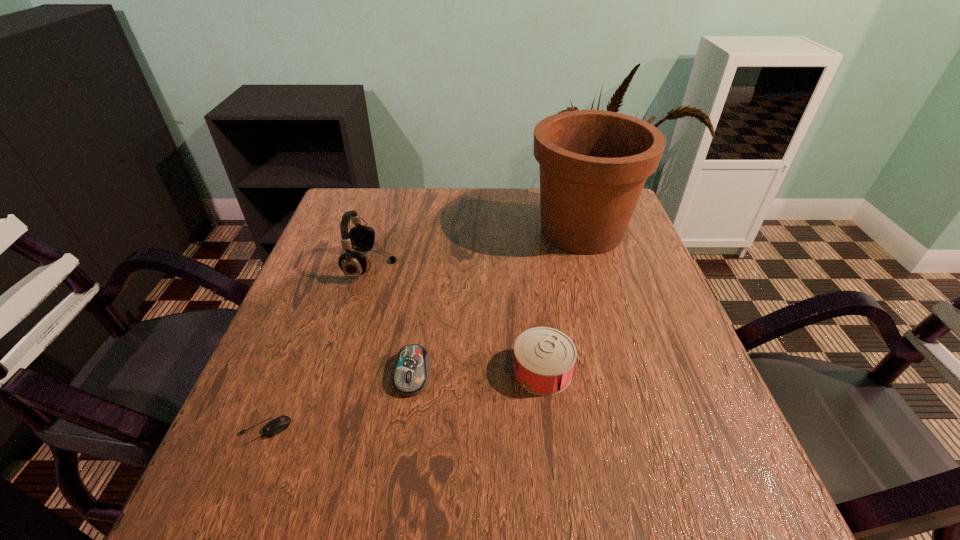
The width and height of the screenshot is (960, 540). Find the location of `vacant area that lies between the flowerpot and the third object from left to right`. vacant area that lies between the flowerpot and the third object from left to right is located at coordinates (496, 302).

Find the location of a particular element. The image size is (960, 540). object that is the second closest to the third shortest object is located at coordinates (593, 164).

Locate an element on the screen. This screenshot has height=540, width=960. object that can be found as the second closest to the headset is located at coordinates (544, 358).

Find the location of a particular element. The image size is (960, 540). vacant space that satisfies the following two spatial constraints: 1. on the back side of the shortest object; 2. on the right side of the tallest object is located at coordinates (345, 230).

Identify the location of free space that satisfies the following two spatial constraints: 1. on the back side of the left mouse; 2. on the right side of the can. (288, 371).

Identify the location of vacant region that satisfies the following two spatial constraints: 1. on the back side of the tallest object; 2. on the right side of the nearer mouse. (345, 230).